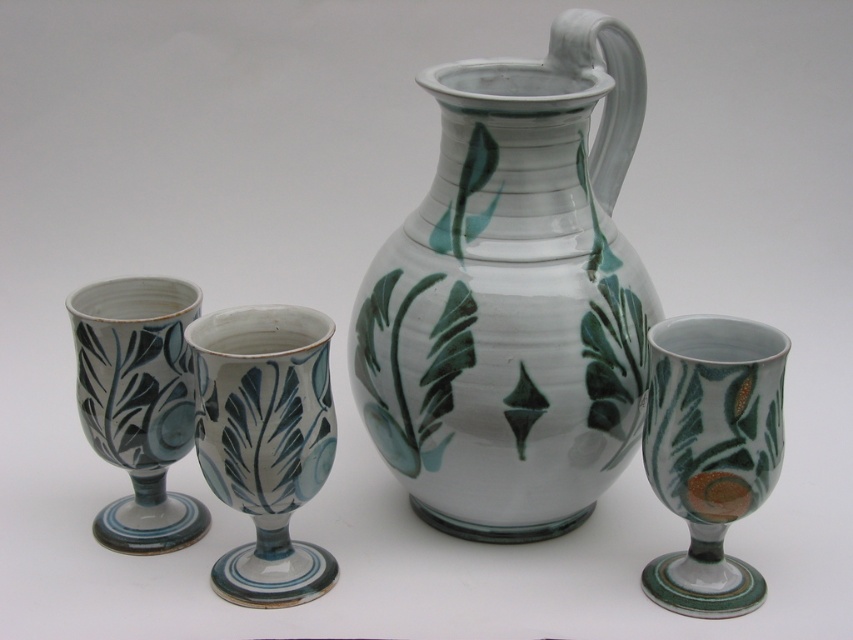
Question: Which of these objects is positioned farthest from the matte ceramic vase at center?

Choices:
 (A) white glossy jug at center
 (B) matte ceramic goblet at right
 (C) matte ceramic goblet at left

Answer: (B)

Question: Is white glossy jug at center thinner than matte ceramic goblet at right?

Choices:
 (A) yes
 (B) no

Answer: (B)

Question: Which point is closer to the camera?

Choices:
 (A) (537, 285)
 (B) (299, 403)

Answer: (B)

Question: Can you confirm if matte ceramic vase at center is wider than matte ceramic goblet at right?

Choices:
 (A) no
 (B) yes

Answer: (B)

Question: Which object is the farthest from the matte ceramic goblet at left?

Choices:
 (A) matte ceramic vase at center
 (B) matte ceramic goblet at right
 (C) white glossy jug at center

Answer: (B)

Question: Can you confirm if white glossy jug at center is bigger than matte ceramic vase at center?

Choices:
 (A) no
 (B) yes

Answer: (B)